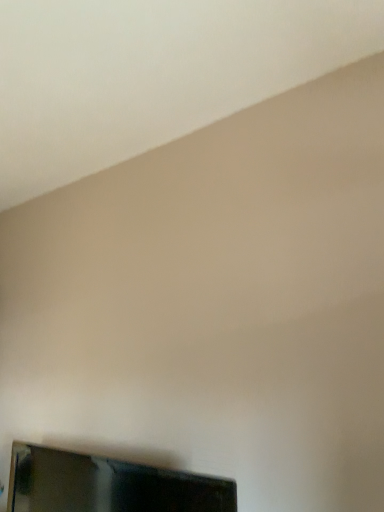
Describe the element at coordinates (108, 485) in the screenshot. This screenshot has height=512, width=384. I see `black glossy tv at lower left` at that location.

The width and height of the screenshot is (384, 512). I want to click on black glossy tv at lower left, so click(x=108, y=485).

This screenshot has height=512, width=384. I want to click on black glossy tv at lower left, so click(108, 485).